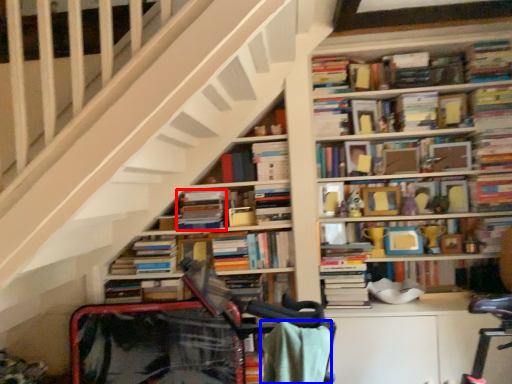
Question: Which object is further to the camera taking this photo, book (highlighted by a red box) or blanket (highlighted by a blue box)?

Choices:
 (A) book
 (B) blanket

Answer: (A)